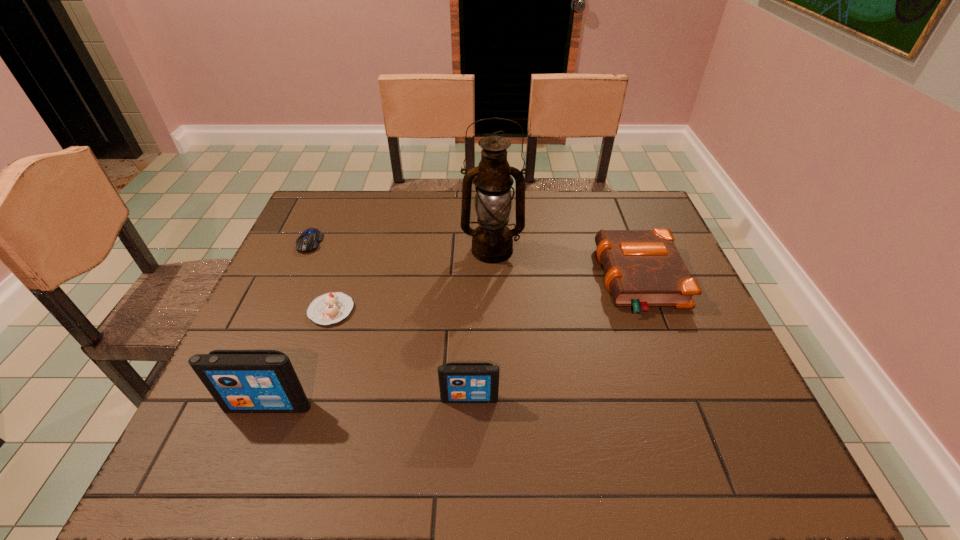
Where is `free space that satisfies the following two spatial constraints: 1. on the button side of the cupcake; 2. on the left side of the shortest object`? Image resolution: width=960 pixels, height=540 pixels. free space that satisfies the following two spatial constraints: 1. on the button side of the cupcake; 2. on the left side of the shortest object is located at coordinates (x=278, y=310).

Locate an element on the screen. This screenshot has height=540, width=960. free point that satisfies the following two spatial constraints: 1. on the button side of the cupcake; 2. on the right side of the shortest object is located at coordinates (278, 310).